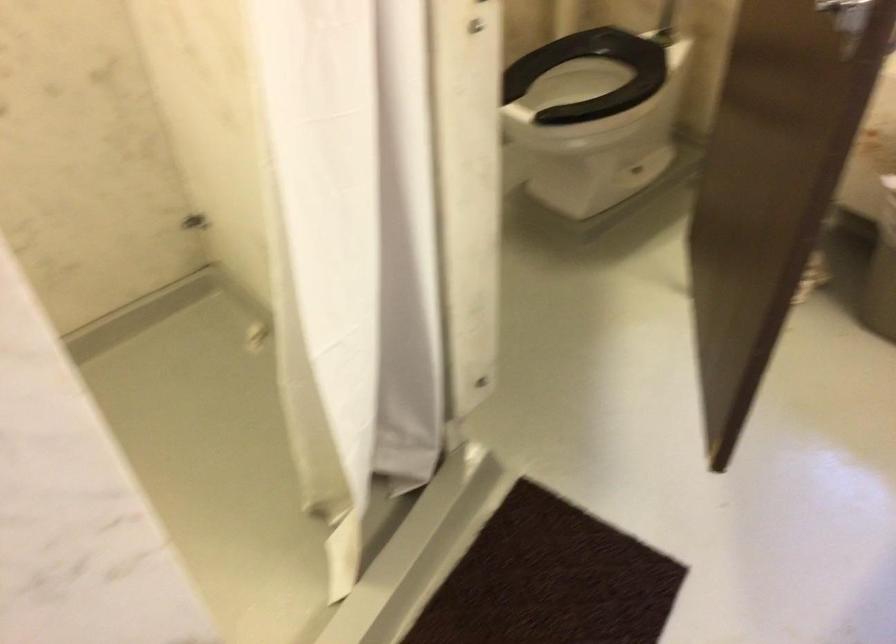
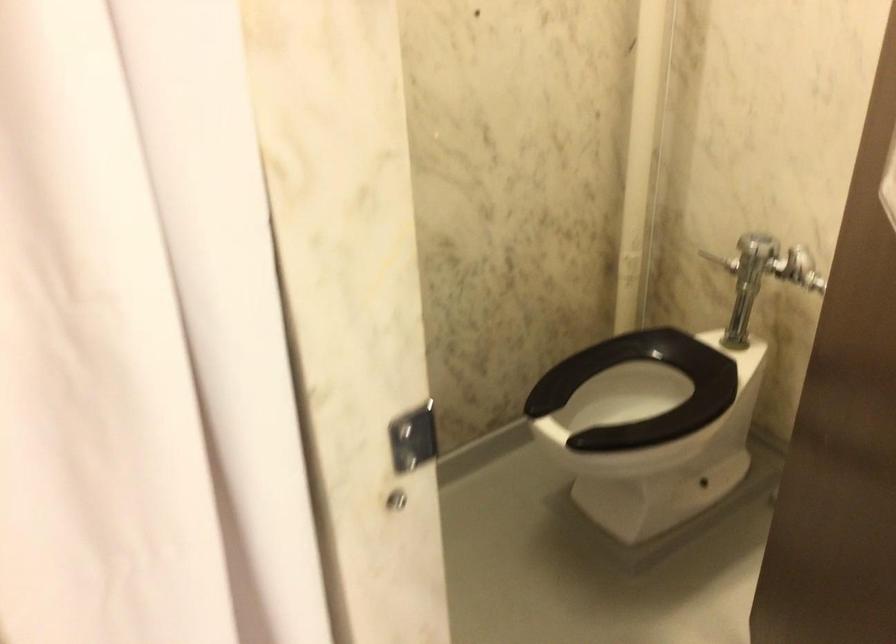
What movement of the cameraman would produce the second image?

The cameraman walked toward right, forward.